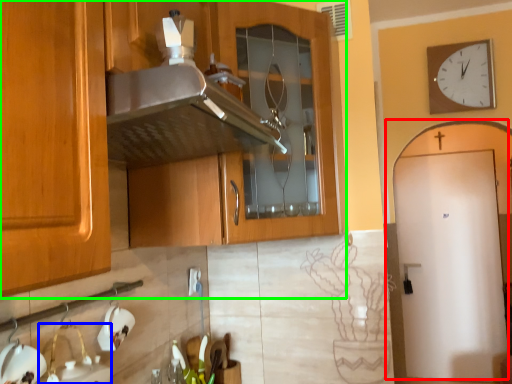
Question: Based on their relative distances, which object is farther from door (highlighted by a red box)? Choose from sink (highlighted by a blue box) and cabinetry (highlighted by a green box).

Choices:
 (A) sink
 (B) cabinetry

Answer: (A)